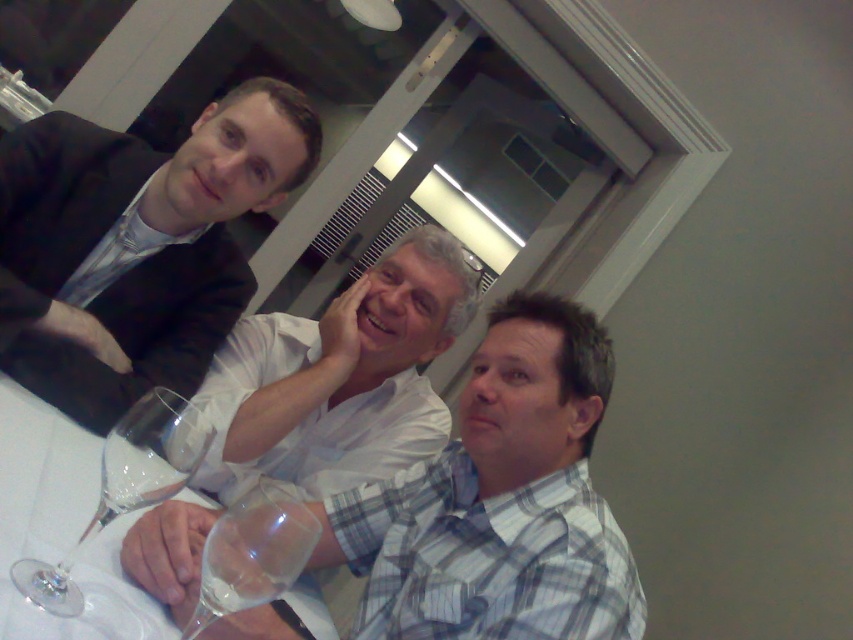
You are a waiter who needs to place a 12 cm wide dessert plate between the transparent glass wine glass at lower center and the clear glass wine at lower left. Can you fit it there?

The distance between the transparent glass wine glass at lower center and the clear glass wine at lower left is 10.39 centimeters. Since the dessert plate is 12 cm wide, it won not fit in the space provided.

You are a photographer adjusting your camera settings to focus on the transparent glass wine glass at lower center. Given that your camera can only focus on objects within a 0.3 unit radius from the center point at coordinates 0.5, 0.5, will the glass be in focus?

The transparent glass wine glass at lower center is located at point (252, 554). The distance from the center point (426, 320) is calculated using the Euclidean distance formula. The difference in the x coordinates is 0.366, and the difference in the y coordinates is 0.203. Squaring these differences gives 0.134 and 0.041, respectively. Adding them together gives 0.175, and taking the square root results in approximately 0.418 units. Since 0.418 is greater than 0.3, the glass is outside the focus range. The